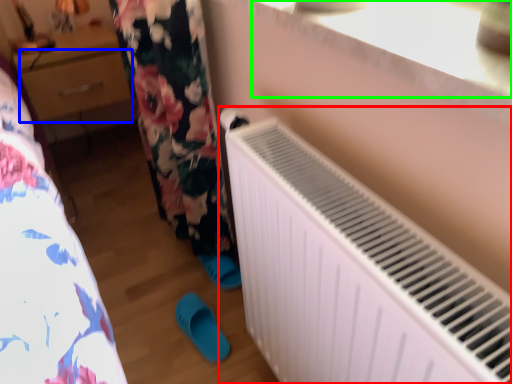
Question: Which object is positioned farthest from radiator (highlighted by a red box)? Select from drawer (highlighted by a blue box) and window sill (highlighted by a green box).

Choices:
 (A) drawer
 (B) window sill

Answer: (A)